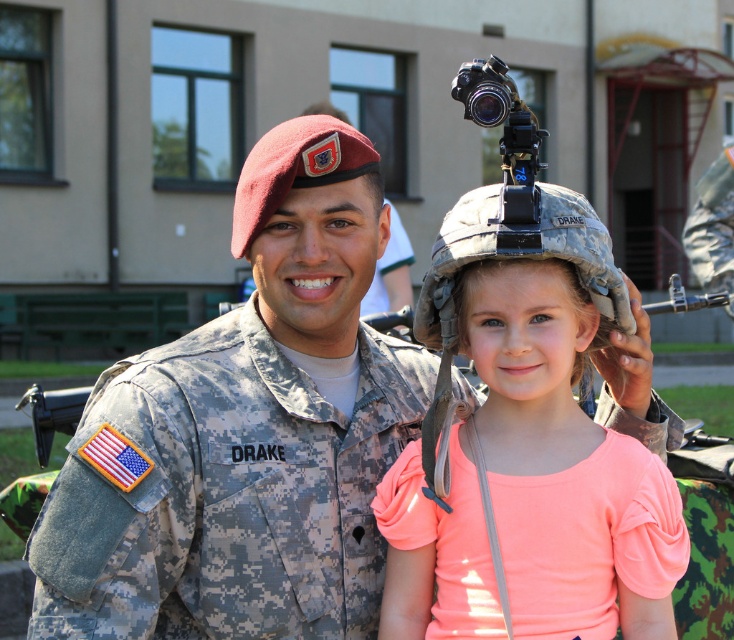
Is camouflage uniform at center shorter than camouflage helmet at center?

No.

What do you see at coordinates (244, 433) in the screenshot?
I see `camouflage uniform at center` at bounding box center [244, 433].

You are a GUI agent. You are given a task and a screenshot of the screen. Output one action in this format:
    pyautogui.click(x=<x>, y=<y>)
    Task: Click on the camouflage uniform at center
    
    Given the screenshot: What is the action you would take?
    pyautogui.click(x=244, y=433)

Between camouflage uniform at center and black matte video camera at upper center, which one is positioned higher?

black matte video camera at upper center

Does camouflage uniform at center come in front of black matte video camera at upper center?

That is False.

Is point (371, 186) positioned before point (484, 90)?

No.

Find the location of `camouflage uniform at center`. camouflage uniform at center is located at coordinates (244, 433).

Is point (570, 218) behind point (520, 144)?

Yes, point (570, 218) is behind point (520, 144).

What do you see at coordinates (553, 420) in the screenshot? I see `camouflage helmet at center` at bounding box center [553, 420].

The width and height of the screenshot is (734, 640). I want to click on camouflage helmet at center, so click(x=553, y=420).